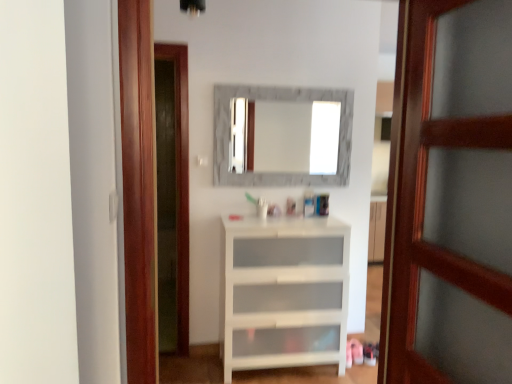
Question: Is marble frame mirror at center completely or partially inside wooden door at right?

Choices:
 (A) no
 (B) yes

Answer: (A)

Question: Is wooden door at right at the right side of marble frame mirror at center?

Choices:
 (A) no
 (B) yes

Answer: (B)

Question: Is wooden door at right oriented towards marble frame mirror at center?

Choices:
 (A) yes
 (B) no

Answer: (B)

Question: Considering the relative sizes of wooden door at right and marble frame mirror at center in the image provided, is wooden door at right smaller than marble frame mirror at center?

Choices:
 (A) yes
 (B) no

Answer: (B)

Question: Considering the relative positions of wooden door at right and marble frame mirror at center in the image provided, is wooden door at right to the left of marble frame mirror at center from the viewer's perspective?

Choices:
 (A) no
 (B) yes

Answer: (A)

Question: From a real-world perspective, is wooden door at right under marble frame mirror at center?

Choices:
 (A) no
 (B) yes

Answer: (B)

Question: Is white glossy cabinet at center thinner than white glossy cabinet at center?

Choices:
 (A) no
 (B) yes

Answer: (A)

Question: Is white glossy cabinet at center smaller than white glossy cabinet at center?

Choices:
 (A) yes
 (B) no

Answer: (A)

Question: From the image's perspective, does white glossy cabinet at center appear lower than white glossy cabinet at center?

Choices:
 (A) yes
 (B) no

Answer: (B)

Question: From the image's perspective, is white glossy cabinet at center over white glossy cabinet at center?

Choices:
 (A) yes
 (B) no

Answer: (A)

Question: Is white glossy cabinet at center wider than white glossy cabinet at center?

Choices:
 (A) no
 (B) yes

Answer: (B)

Question: Can you confirm if white glossy cabinet at center is positioned to the right of white glossy cabinet at center?

Choices:
 (A) no
 (B) yes

Answer: (B)

Question: Is the depth of white glossy cabinet at center less than that of white glossy cabinet at center?

Choices:
 (A) yes
 (B) no

Answer: (A)